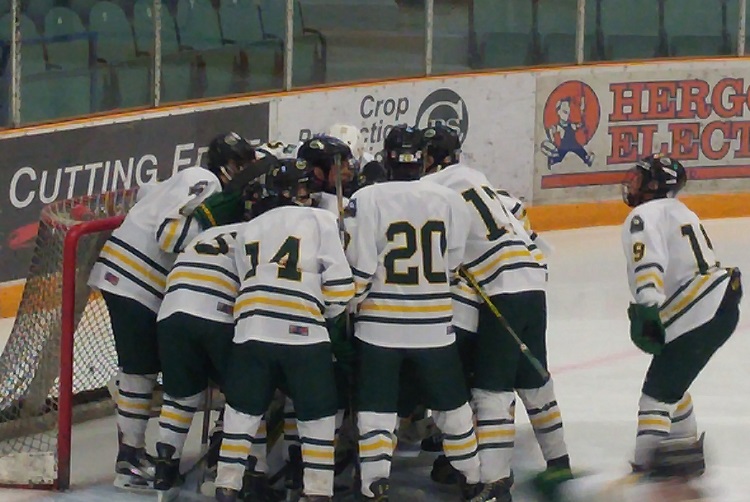
The width and height of the screenshot is (750, 502). I want to click on windows, so click(76, 55), click(229, 27), click(349, 39), click(501, 37), click(637, 34).